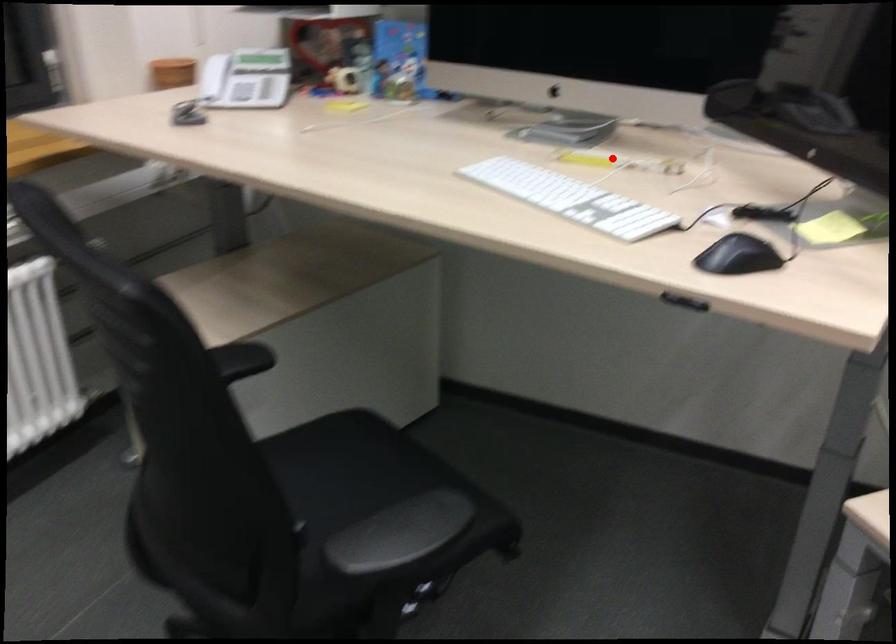
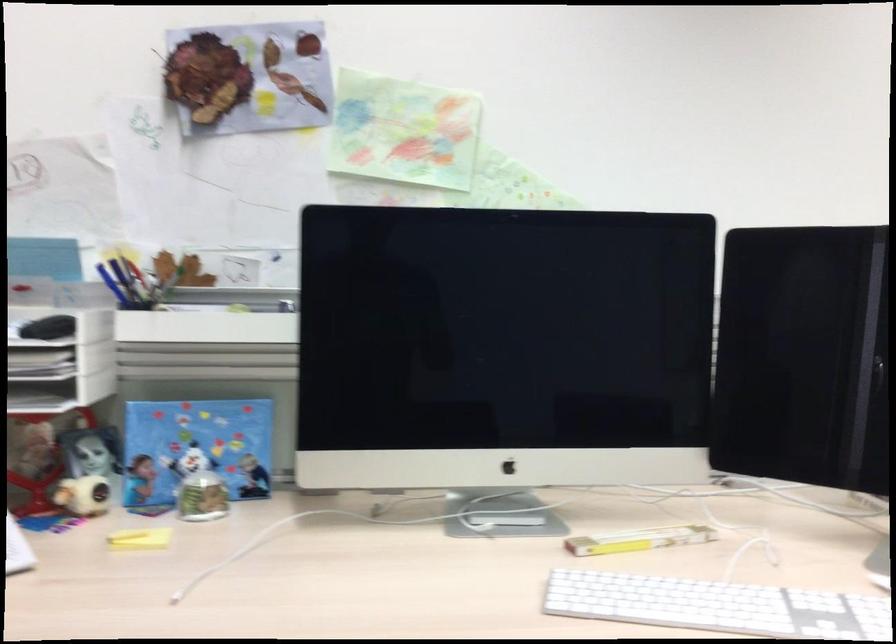
In the second image, find the point that corresponds to the highlighted location in the first image.

(638, 540)